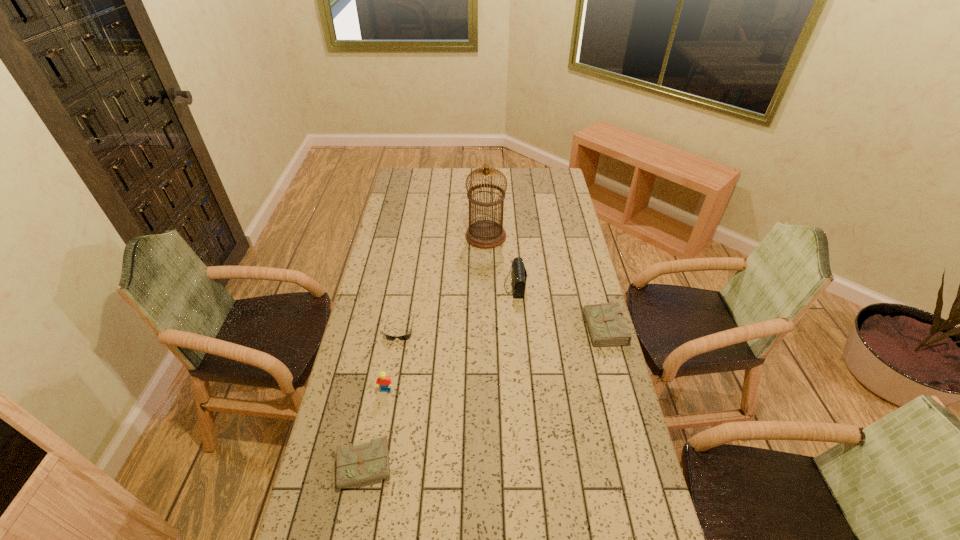
Find the location of a particular element. This screenshot has height=540, width=960. the shorter diary is located at coordinates (359, 464).

The image size is (960, 540). I want to click on the nearer diary, so click(359, 464).

The height and width of the screenshot is (540, 960). In order to click on the rightmost object in this screenshot , I will do `click(606, 327)`.

This screenshot has height=540, width=960. I want to click on the fourth tallest object, so click(x=606, y=327).

This screenshot has height=540, width=960. In order to click on clutch bag in this screenshot , I will do `click(519, 275)`.

Identify the location of birdcage. This screenshot has height=540, width=960. (485, 234).

In order to click on the tallest object in this screenshot , I will do `click(485, 234)`.

Find the location of `sunglasses`. sunglasses is located at coordinates (405, 337).

The width and height of the screenshot is (960, 540). What are the coordinates of `Lego` in the screenshot? It's located at (383, 380).

Image resolution: width=960 pixels, height=540 pixels. Identify the location of vacant space located 0.080m on the front of the shorter diary. (360, 523).